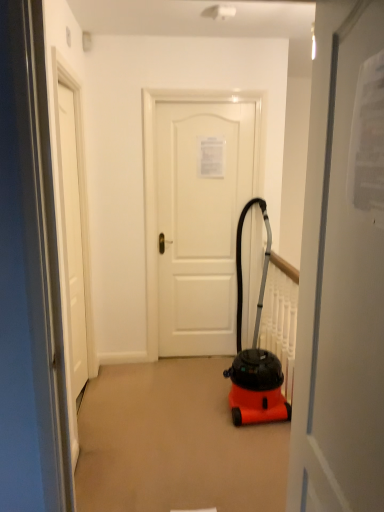
Question: Considering the relative positions of white matte door at center, the 3th door viewed from the left, and white matte door at center, which ranks as the third door in right-to-left order, in the image provided, is white matte door at center, the 3th door viewed from the left, to the left of white matte door at center, which ranks as the third door in right-to-left order, from the viewer's perspective?

Choices:
 (A) no
 (B) yes

Answer: (A)

Question: Does white matte door at center, arranged as the 1th door when viewed from the front, have a greater height compared to white matte door at center, placed as the 2th door when sorted from front to back?

Choices:
 (A) yes
 (B) no

Answer: (B)

Question: From a real-world perspective, is white matte door at center, the 3th door viewed from the left, over white matte door at center, the first door when ordered from left to right?

Choices:
 (A) no
 (B) yes

Answer: (B)

Question: Is white matte door at center, arranged as the 1th door when viewed from the front, next to white matte door at center, placed as the 2th door when sorted from front to back, and touching it?

Choices:
 (A) no
 (B) yes

Answer: (A)

Question: Can you confirm if white matte door at center, arranged as the 1th door when viewed from the right, is wider than white matte door at center, positioned as the second door in back-to-front order?

Choices:
 (A) yes
 (B) no

Answer: (A)

Question: Is white matte door at center, arranged as the 1th door when viewed from the front, wider or thinner than white matte door at center, which ranks as the third door in right-to-left order?

Choices:
 (A) wide
 (B) thin

Answer: (A)

Question: Visually, is white matte door at center, arranged as the 1th door when viewed from the right, positioned to the left or to the right of white matte door at center, placed as the 2th door when sorted from front to back?

Choices:
 (A) left
 (B) right

Answer: (B)

Question: From a real-world perspective, is white matte door at center, placed as the 3th door when sorted from back to front, physically located above or below white matte door at center, positioned as the second door in back-to-front order?

Choices:
 (A) below
 (B) above

Answer: (B)

Question: From their relative heights in the image, would you say white matte door at center, arranged as the 1th door when viewed from the front, is taller or shorter than white matte door at center, which ranks as the third door in right-to-left order?

Choices:
 (A) tall
 (B) short

Answer: (B)

Question: Is white matte door at center, the second door when ordered from right to left, wider or thinner than orange matte vacuum cleaner at center?

Choices:
 (A) wide
 (B) thin

Answer: (B)

Question: Visually, is white matte door at center, the second door when ordered from right to left, positioned to the left or to the right of orange matte vacuum cleaner at center?

Choices:
 (A) left
 (B) right

Answer: (A)

Question: From a real-world perspective, is white matte door at center, positioned as the 3th door in front-to-back order, positioned above or below orange matte vacuum cleaner at center?

Choices:
 (A) above
 (B) below

Answer: (A)

Question: Considering the positions of white matte door at center, the 1th door when ordered from back to front, and orange matte vacuum cleaner at center in the image, is white matte door at center, the 1th door when ordered from back to front, taller or shorter than orange matte vacuum cleaner at center?

Choices:
 (A) short
 (B) tall

Answer: (B)

Question: Considering the positions of point tap(211, 241) and point tap(342, 398), is point tap(211, 241) closer or farther from the camera than point tap(342, 398)?

Choices:
 (A) farther
 (B) closer

Answer: (A)

Question: Is white matte door at center, the 1th door when ordered from back to front, in front of or behind white matte door at center, arranged as the 1th door when viewed from the front, in the image?

Choices:
 (A) behind
 (B) front

Answer: (A)